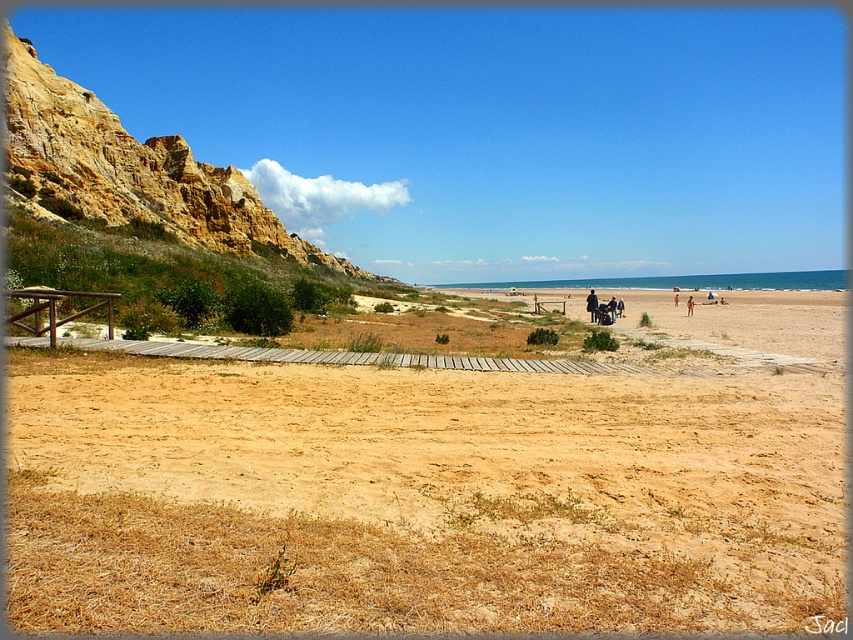
You are standing on the wooden walkway and want to reach the brown sandy dirt field at center. Which direction should you head relative to the rustic stone cliff at left?

You should head to the right of the rustic stone cliff at left to reach the brown sandy dirt field at center.

You are standing on the wooden walkway and want to reach the two points marked in the image. Which point, point (469, 632) or point (221, 236), is closer to you?

Point (469, 632) is closer to the viewer than point (221, 236).